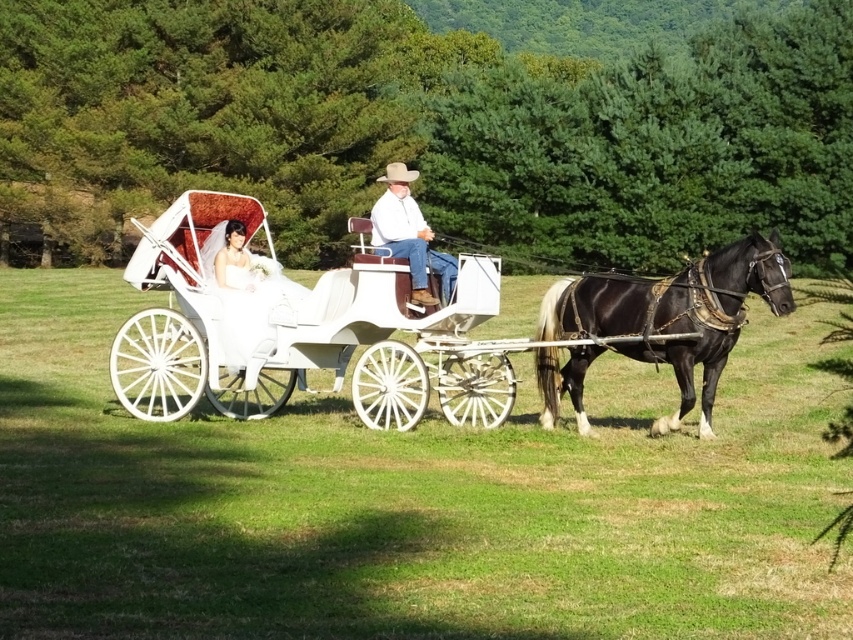
You are standing at a point 35.98 feet away from the camera. You want to take a photo of the white horse drawn carriage with the bride and driver. Where should you position yourself relative to the point marked at coordinates point (364, 380) to ensure the entire carriage and its occupants are in frame?

You should position yourself at the point marked at coordinates point (364, 380) since that is exactly where you need to be to capture the entire carriage and its occupants in the frame, as you are 35.98 feet away from the camera.

Consider the image. You are a photographer wanting to capture the black glossy horse at right and the white leather coach at center in a single frame. Based on their positions, will the horse be visible in the photo if you focus on the coach?

The black glossy horse at right is positioned under the white leather coach at center, so if you focus on the coach, the horse will still be visible in the photo as it is directly underneath.